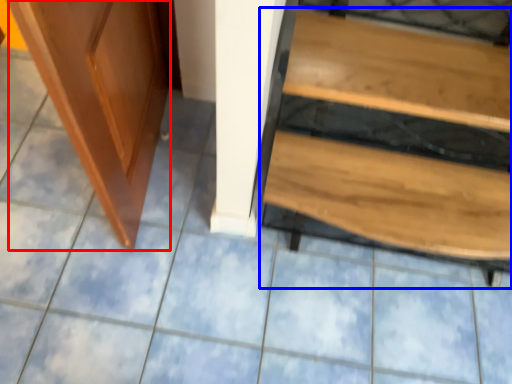
Question: Which of the following is the farthest to the observer, screen door (highlighted by a red box) or furniture (highlighted by a blue box)?

Choices:
 (A) screen door
 (B) furniture

Answer: (B)